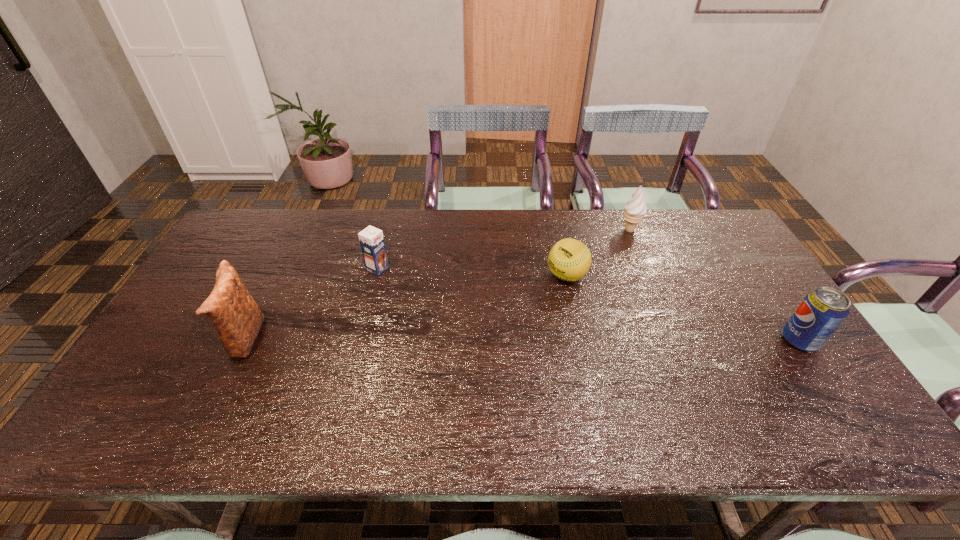
Where is `empty space between the farthest object and the soda`? The image size is (960, 540). empty space between the farthest object and the soda is located at coordinates (714, 285).

The image size is (960, 540). I want to click on vacant area between the softball and the rightmost object, so click(x=684, y=308).

Image resolution: width=960 pixels, height=540 pixels. Identify the location of vacant area that lies between the second object from right to left and the soda. (714, 285).

This screenshot has width=960, height=540. What are the coordinates of `free space that is in between the leftmost object and the rightmost object` in the screenshot? It's located at (522, 340).

Image resolution: width=960 pixels, height=540 pixels. What are the coordinates of `free area in between the chocolate milk and the shortest object` in the screenshot? It's located at (472, 272).

Locate an element on the screen. The width and height of the screenshot is (960, 540). vacant area that lies between the icecream and the chocolate milk is located at coordinates (503, 249).

Identify the location of empty space between the softball and the soda. The height and width of the screenshot is (540, 960). (684, 308).

The height and width of the screenshot is (540, 960). Find the location of `free space that is in between the clutch bag and the shortest object`. free space that is in between the clutch bag and the shortest object is located at coordinates (405, 307).

Locate an element on the screen. free spot between the fourth object from right to left and the third object from left to right is located at coordinates (472, 272).

This screenshot has width=960, height=540. Find the location of `the second closest object to the chocolate milk`. the second closest object to the chocolate milk is located at coordinates (569, 259).